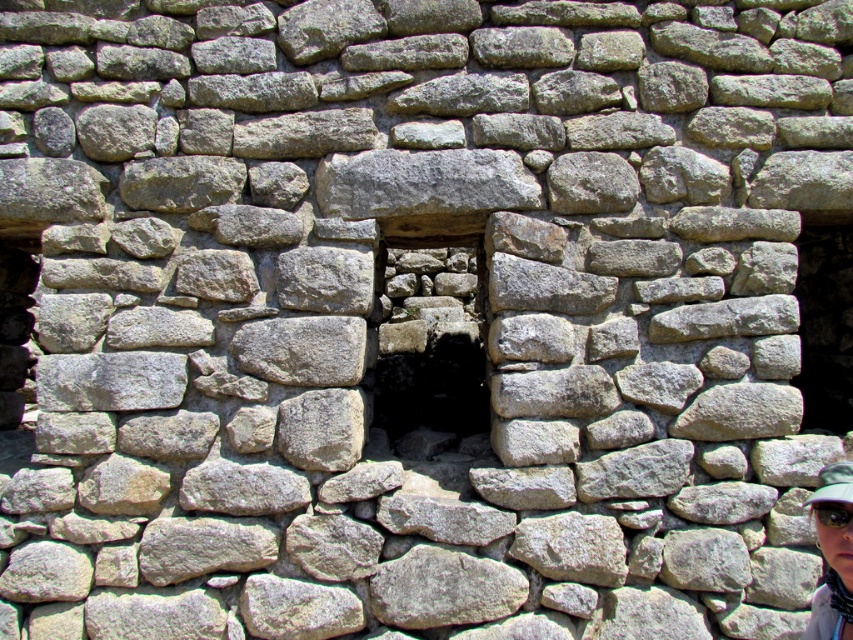
At what (x,y) coordinates should I click in order to perform the action: click on matte gray hat at lower right. Please return your answer as a coordinate pair (x, y). Looking at the image, I should click on (833, 552).

Can you confirm if matte gray hat at lower right is bigger than black fabric baseball cap at lower right?

Indeed, matte gray hat at lower right has a larger size compared to black fabric baseball cap at lower right.

Is point (825, 541) positioned after point (840, 492)?

Yes.

Find the location of a particular element. The height and width of the screenshot is (640, 853). matte gray hat at lower right is located at coordinates (833, 552).

Which is below, natural stone window at center or matte gray hat at lower right?

matte gray hat at lower right is lower down.

Who is taller, natural stone window at center or matte gray hat at lower right?

natural stone window at center

Who is more distant from viewer, (447, 236) or (828, 548)?

The point (447, 236) is behind.

You are a GUI agent. You are given a task and a screenshot of the screen. Output one action in this format:
    pyautogui.click(x=<x>, y=<y>)
    Task: Click on the natural stone window at center
    This screenshot has width=853, height=640.
    Given the screenshot: What is the action you would take?
    pyautogui.click(x=432, y=336)

Does natural stone window at center appear over black fabric baseball cap at lower right?

Indeed, natural stone window at center is positioned over black fabric baseball cap at lower right.

Is natural stone window at center to the left of black fabric baseball cap at lower right from the viewer's perspective?

Correct, you'll find natural stone window at center to the left of black fabric baseball cap at lower right.

Is point (451, 230) farther from viewer compared to point (827, 468)?

Yes, point (451, 230) is behind point (827, 468).

Where is `natural stone window at center`? natural stone window at center is located at coordinates (432, 336).